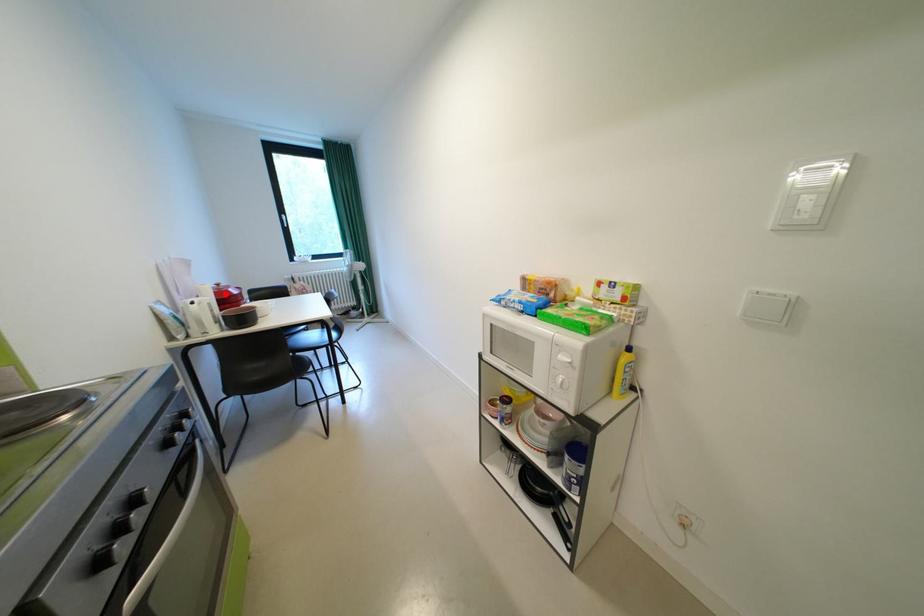
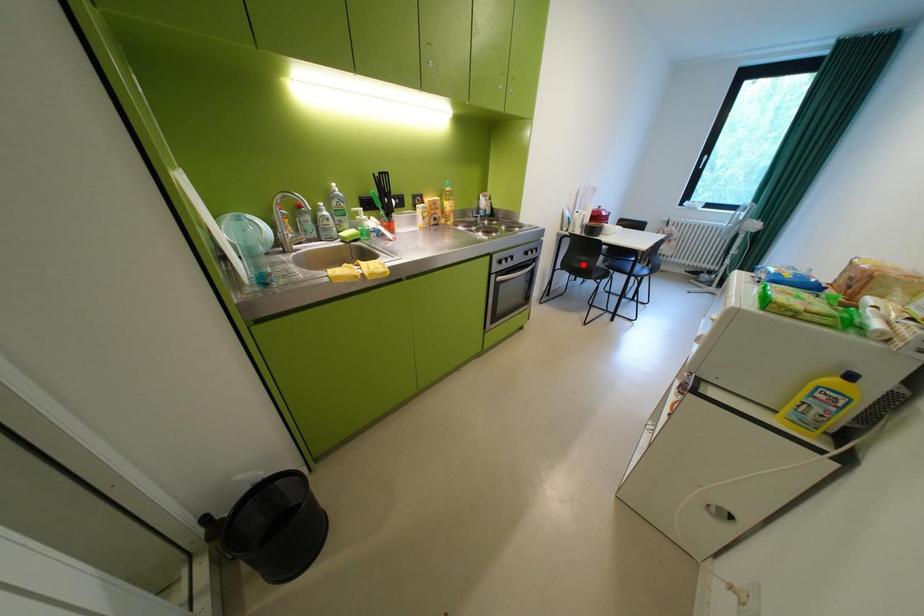
I am providing you with two images of the same scene from different viewpoints. A red point is marked on the first image and another point is marked on the second image. Do the highlighted points in image1 and image2 indicate the same real-world spot?

No